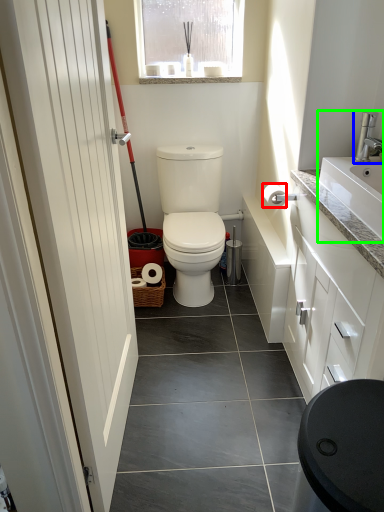
Question: Based on their relative distances, which object is nearer to toilet paper (highlighted by a red box)? Choose from tap (highlighted by a blue box) and sink (highlighted by a green box).

Choices:
 (A) tap
 (B) sink

Answer: (A)